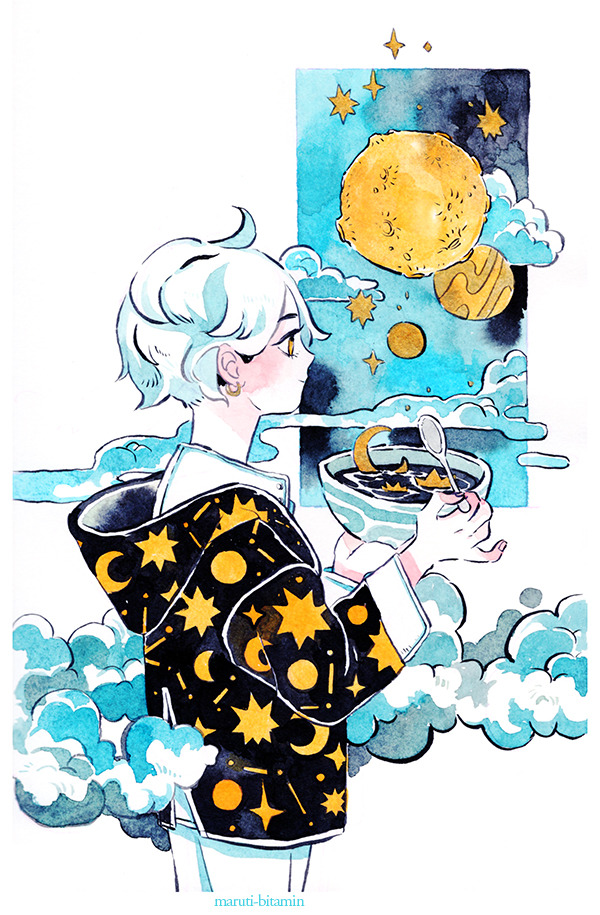
The width and height of the screenshot is (600, 915). I want to click on bowl, so click(366, 507).